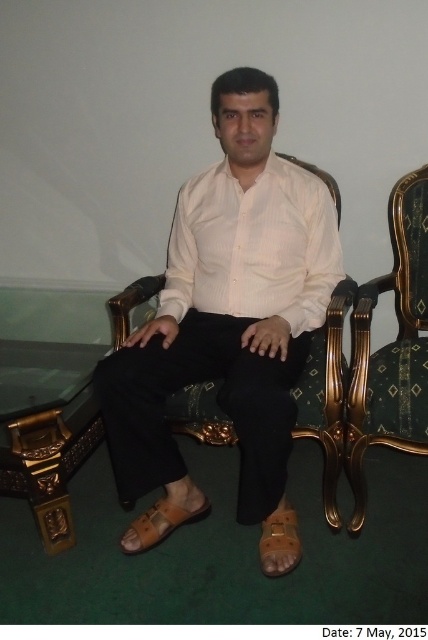
Consider the image. Can you confirm if white ribbed shirt at center is thinner than velvet green armchair at right?

In fact, white ribbed shirt at center might be wider than velvet green armchair at right.

Does point (240, 275) come farther from viewer compared to point (407, 232)?

No.

Is point (261, 211) more distant than point (404, 218)?

No, (261, 211) is in front of (404, 218).

Identify the location of white ribbed shirt at center. (253, 246).

Is brown leather sandal at lower center taller than tan leather sandal at lower center?

Correct, brown leather sandal at lower center is much taller as tan leather sandal at lower center.

Locate an element on the screen. Image resolution: width=428 pixels, height=640 pixels. brown leather sandal at lower center is located at coordinates (279, 541).

Where is `brown leather sandal at lower center`? The height and width of the screenshot is (640, 428). brown leather sandal at lower center is located at coordinates (279, 541).

Can you confirm if matte white shirt at center is positioned to the left of brown leather sandal at lower center?

Indeed, matte white shirt at center is positioned on the left side of brown leather sandal at lower center.

Does matte white shirt at center appear under brown leather sandal at lower center?

Actually, matte white shirt at center is above brown leather sandal at lower center.

Does point (184, 378) lie behind point (267, 544)?

No.

Locate an element on the screen. The image size is (428, 640). matte white shirt at center is located at coordinates (228, 308).